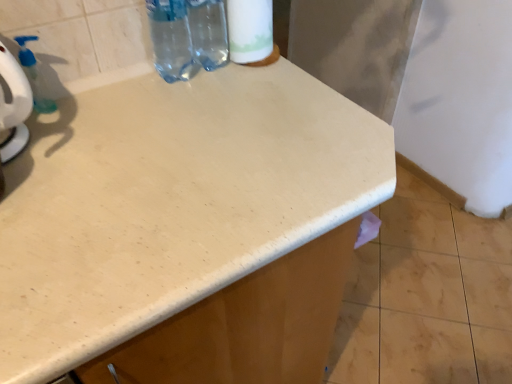
Question: Can you confirm if transparent plastic bottle at upper center, which is the second bottle in right-to-left order, is wider than transparent plastic soap dispenser at upper left?

Choices:
 (A) yes
 (B) no

Answer: (A)

Question: Is transparent plastic bottle at upper center, the first bottle viewed from the left, positioned before transparent plastic soap dispenser at upper left?

Choices:
 (A) yes
 (B) no

Answer: (A)

Question: Is transparent plastic bottle at upper center, the first bottle viewed from the left, positioned with its back to transparent plastic soap dispenser at upper left?

Choices:
 (A) no
 (B) yes

Answer: (A)

Question: Is transparent plastic bottle at upper center, which is the second bottle in right-to-left order, not within transparent plastic soap dispenser at upper left?

Choices:
 (A) no
 (B) yes

Answer: (B)

Question: Is transparent plastic bottle at upper center, the first bottle viewed from the left, smaller than transparent plastic soap dispenser at upper left?

Choices:
 (A) yes
 (B) no

Answer: (B)

Question: In terms of size, does transparent plastic bottle at upper center, the first bottle viewed from the left, appear bigger or smaller than transparent plastic bottle at upper center, arranged as the second bottle when viewed from the left?

Choices:
 (A) small
 (B) big

Answer: (A)

Question: Is transparent plastic bottle at upper center, which is the second bottle in right-to-left order, situated inside transparent plastic bottle at upper center, arranged as the second bottle when viewed from the left, or outside?

Choices:
 (A) inside
 (B) outside

Answer: (A)

Question: Is transparent plastic bottle at upper center, the first bottle viewed from the left, to the left or to the right of transparent plastic bottle at upper center, which is counted as the 1th bottle, starting from the right, in the image?

Choices:
 (A) left
 (B) right

Answer: (A)

Question: Considering their positions, is transparent plastic bottle at upper center, which is the second bottle in right-to-left order, located in front of or behind transparent plastic bottle at upper center, arranged as the second bottle when viewed from the left?

Choices:
 (A) front
 (B) behind

Answer: (A)

Question: From the image's perspective, is transparent plastic soap dispenser at upper left located above or below white matte toilet paper at upper center?

Choices:
 (A) above
 (B) below

Answer: (B)

Question: Considering the positions of transparent plastic soap dispenser at upper left and white matte toilet paper at upper center in the image, is transparent plastic soap dispenser at upper left taller or shorter than white matte toilet paper at upper center?

Choices:
 (A) short
 (B) tall

Answer: (A)

Question: Is transparent plastic soap dispenser at upper left situated inside white matte toilet paper at upper center or outside?

Choices:
 (A) inside
 (B) outside

Answer: (B)

Question: From a real-world perspective, relative to white matte toilet paper at upper center, is transparent plastic soap dispenser at upper left vertically above or below?

Choices:
 (A) below
 (B) above

Answer: (A)

Question: Considering the positions of point (32, 97) and point (167, 57), is point (32, 97) closer or farther from the camera than point (167, 57)?

Choices:
 (A) farther
 (B) closer

Answer: (B)

Question: Considering their positions, is transparent plastic soap dispenser at upper left located in front of or behind transparent plastic bottle at upper center, the first bottle viewed from the left?

Choices:
 (A) front
 (B) behind

Answer: (B)